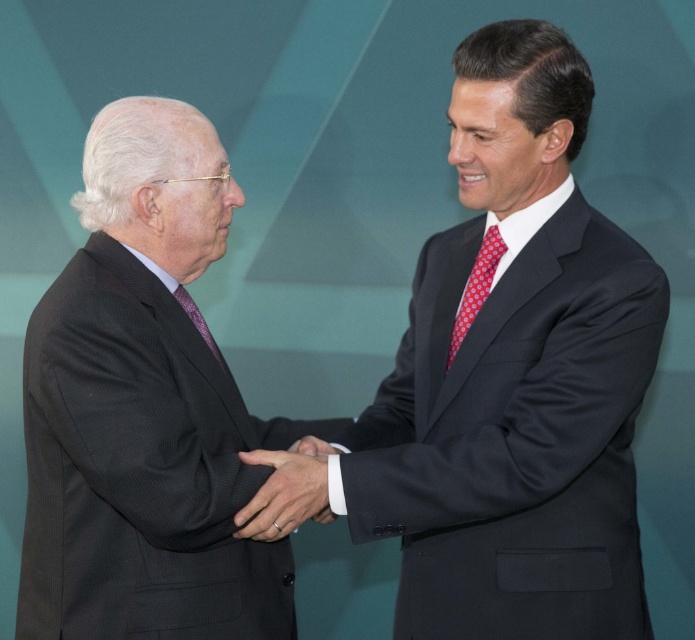
You are attending a formal event and need to determine the spatial arrangement of the attire in the image. Which object is located below the other between the matte black suit at center and the red dotted tie at right?

The matte black suit at center is positioned under the red dotted tie at right, meaning the red dotted tie at right is above it.

You are a photographer setting up a shoot. You need to position a light source to the right of the white satin cuff at center. Based on the scene, which object should you place the light to the right of to ensure it aligns with the dark gray suit at left?

The light should be placed to the right of the white satin cuff at center because the dark gray suit at left is to the left of the white satin cuff at center, so positioning the light to the right of the white satin cuff at center will be to the right of the dark gray suit at left.

You are a photographer standing at the point marked as point (155,380). You want to take a photo of the two men shaking hands. Since they are 1.35 meters apart, will you need to adjust your camera to focus on both of them at the same time?

The two men are 1.35 meters apart. Since the photographer is at point (155,380), they should ensure the camera has a wide enough focus range to capture both individuals simultaneously. Most cameras can handle this distance without issue, so no adjustment is likely needed.